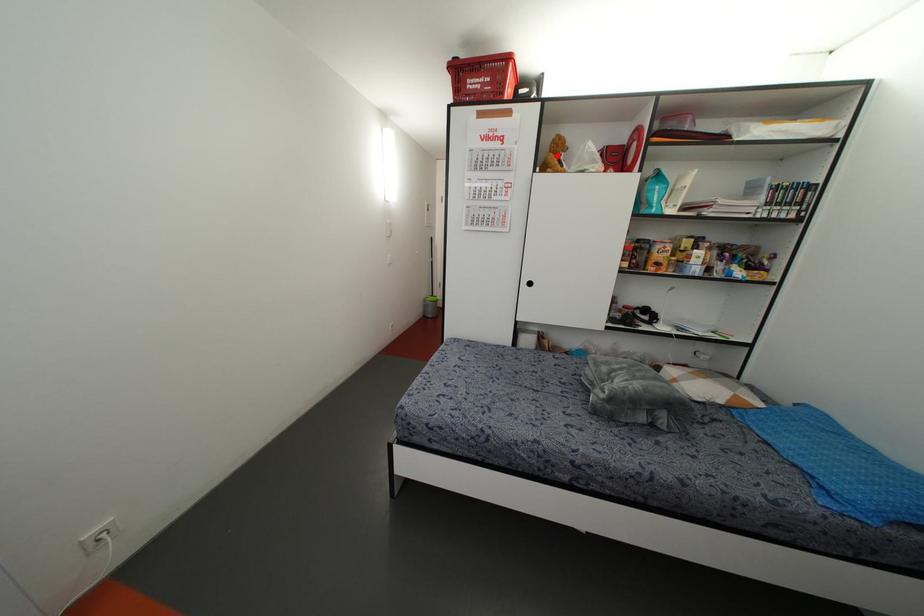
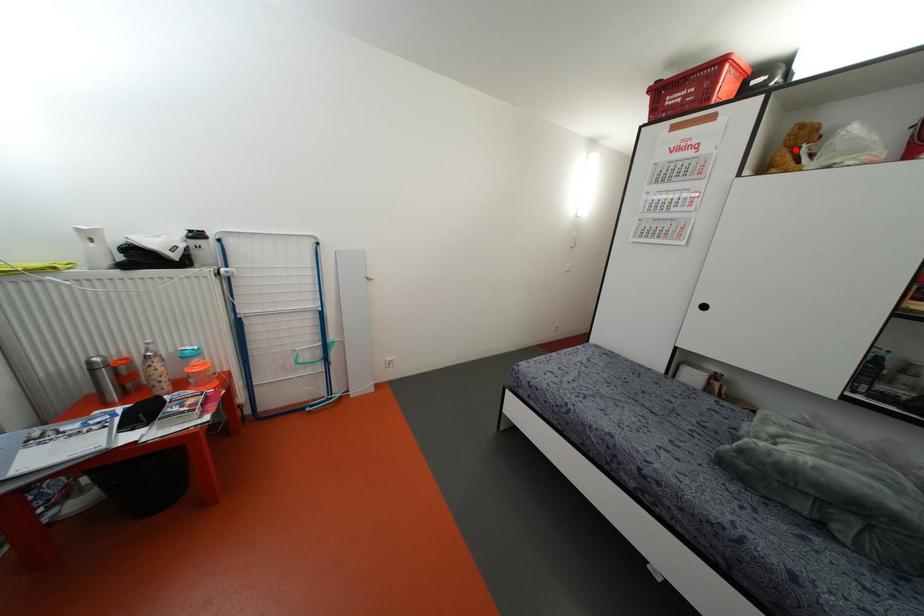
I am providing you with two images of the same scene from different viewpoints. A red point is marked on the first image and another point is marked on the second image. Are the points marked in image1 and image2 representing the same 3D position?

Yes